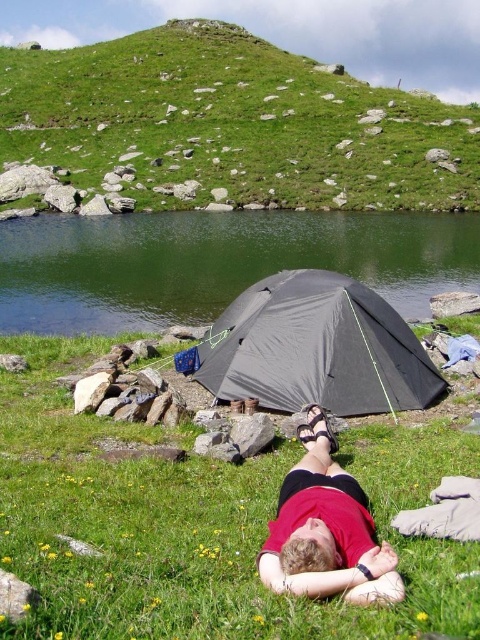
Question: Is the position of green grass at center less distant than that of green smooth water at center?

Choices:
 (A) no
 (B) yes

Answer: (B)

Question: Among these objects, which one is nearest to the camera?

Choices:
 (A) dark gray fabric tent at center
 (B) matte red shirt at lower center
 (C) green smooth water at center

Answer: (B)

Question: Does green smooth water at center lie in front of matte red shirt at lower center?

Choices:
 (A) yes
 (B) no

Answer: (B)

Question: Which object is closer to the camera taking this photo?

Choices:
 (A) matte red shirt at lower center
 (B) green grass at center
 (C) dark gray fabric tent at center
 (D) green grass at upper center

Answer: (B)

Question: Which object is the closest to the green smooth water at center?

Choices:
 (A) matte red shirt at lower center
 (B) green grass at upper center

Answer: (A)

Question: Can you confirm if green grass at upper center is wider than dark gray fabric tent at center?

Choices:
 (A) no
 (B) yes

Answer: (B)